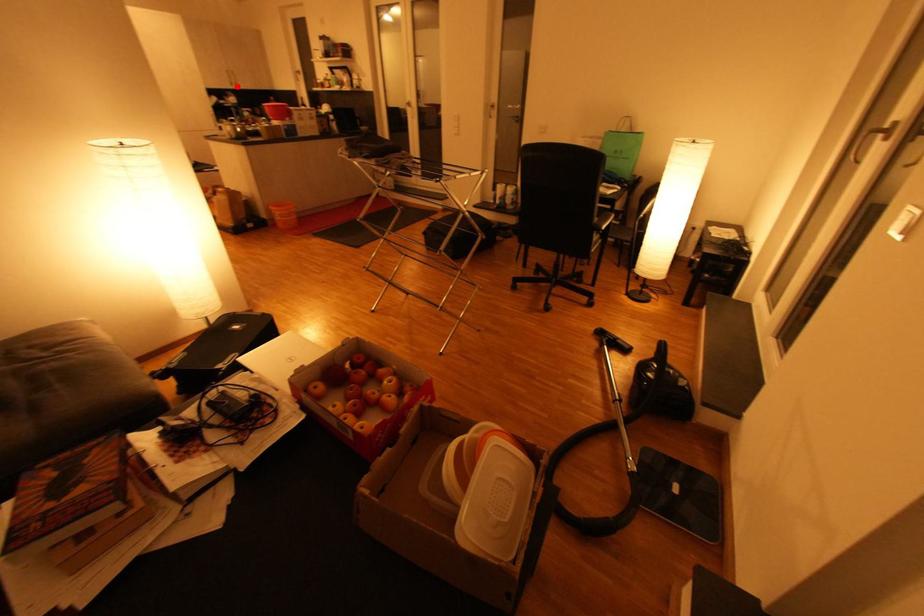
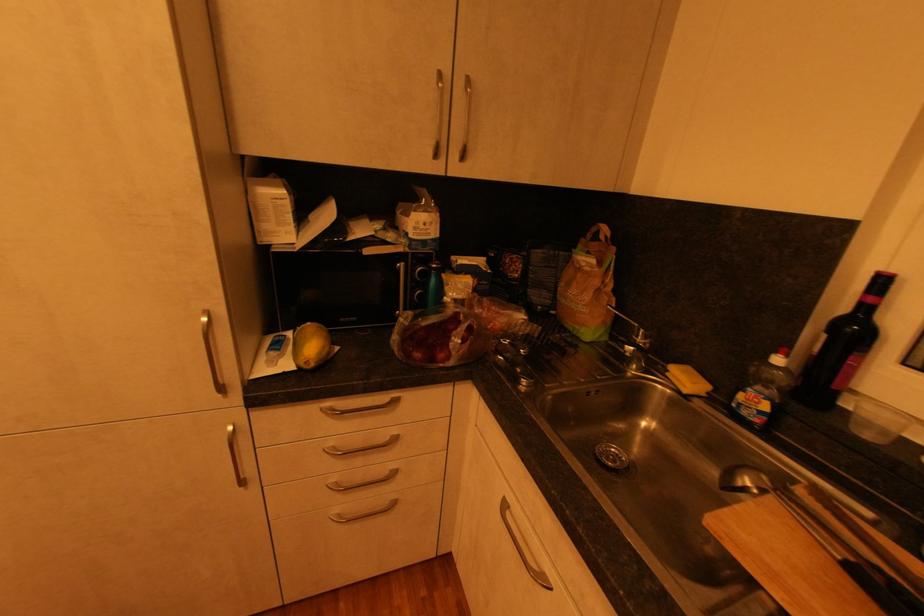
The point at the highlighted location is marked in the first image. Where is the corresponding point in the second image?

(441, 156)